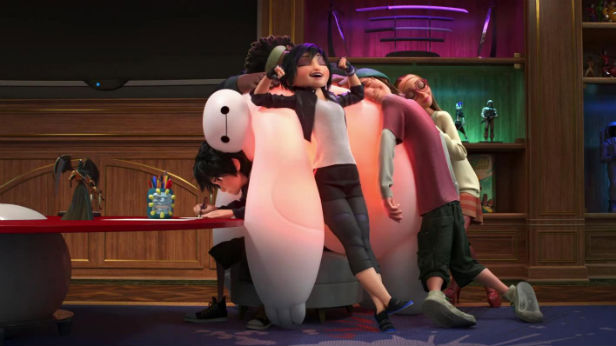
Where is `floor`? floor is located at coordinates (549, 330).